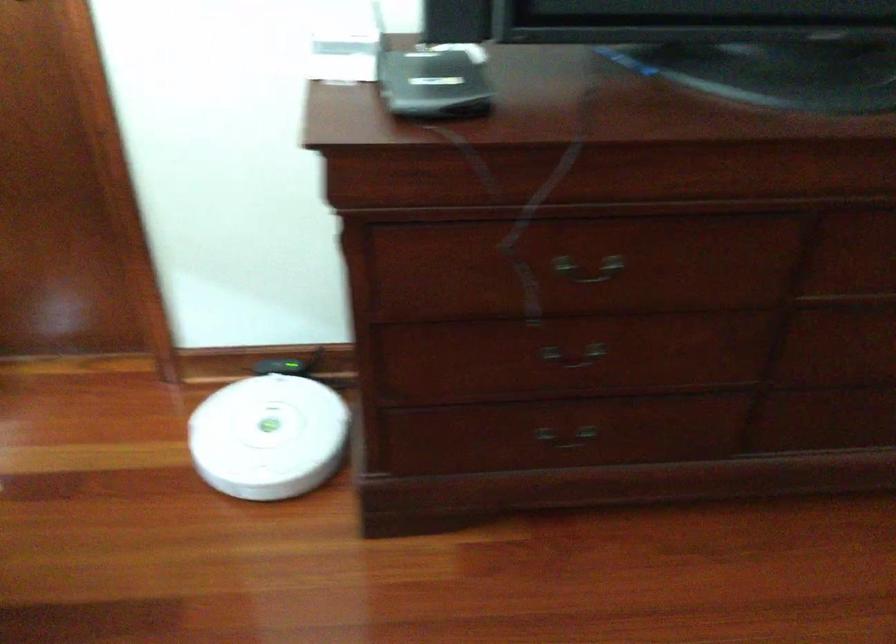
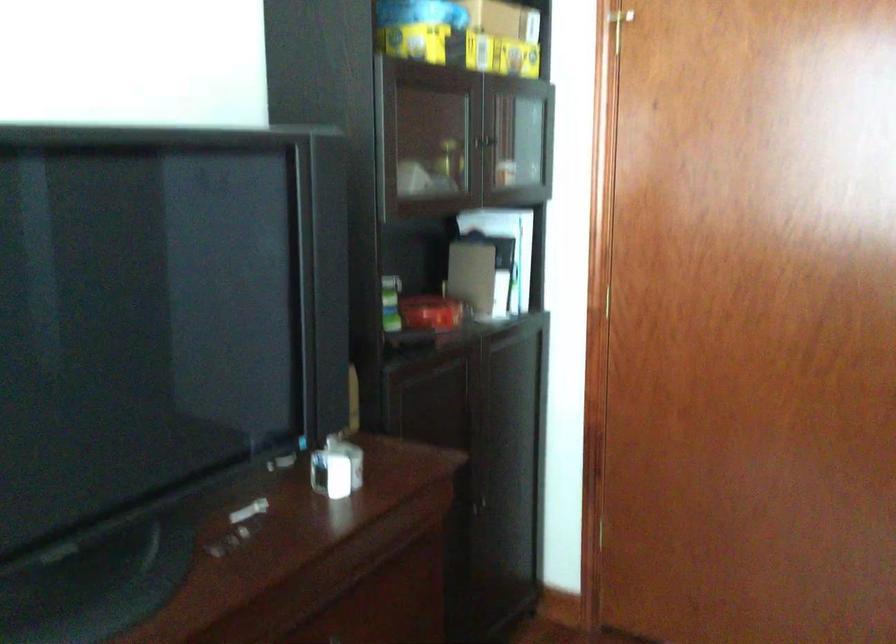
Question: The camera is either moving clockwise (left) or counter-clockwise (right) around the object. The first image is from the beginning of the video and the second image is from the end. Is the camera moving left or right when shooting the video?

Choices:
 (A) Left
 (B) Right

Answer: (A)